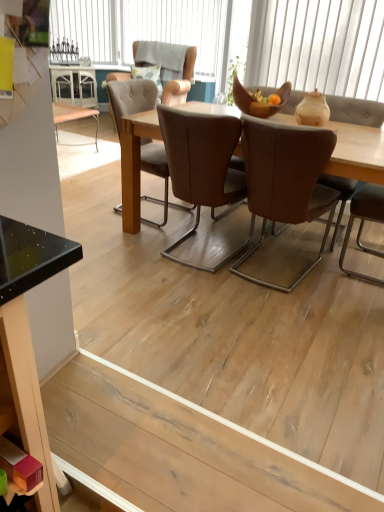
The width and height of the screenshot is (384, 512). What are the coordinates of `vacant area that lies in front of brown leather chair at center, the third chair viewed from the back` in the screenshot? It's located at (279, 316).